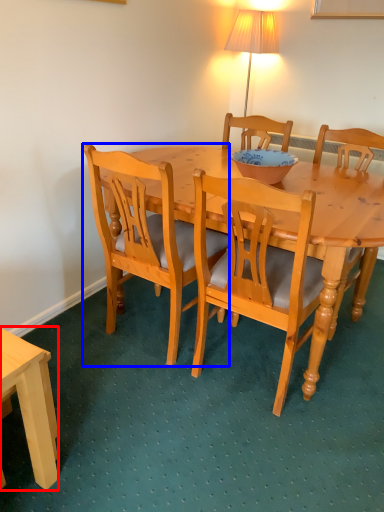
Question: Among these objects, which one is nearest to the camera, desk (highlighted by a red box) or chair (highlighted by a blue box)?

Choices:
 (A) desk
 (B) chair

Answer: (A)